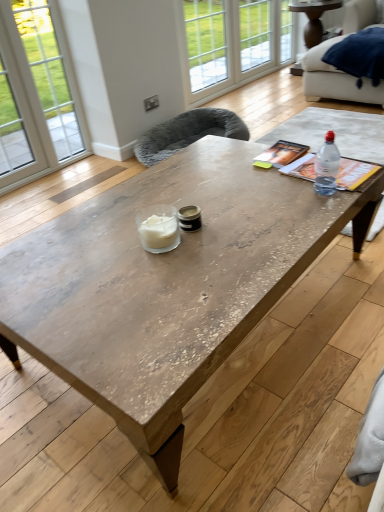
Question: Should I look upward or downward to see clear plastic bottle at upper right?

Choices:
 (A) up
 (B) down

Answer: (A)

Question: From a real-world perspective, is clear glass window at upper center, the 2th window from the left, located beneath wooden side table at upper right?

Choices:
 (A) no
 (B) yes

Answer: (A)

Question: Does clear glass window at upper center, the 2th window from the left, have a larger size compared to wooden side table at upper right?

Choices:
 (A) no
 (B) yes

Answer: (A)

Question: Is clear glass window at upper center, which ranks as the second window in right-to-left order, not inside wooden side table at upper right?

Choices:
 (A) yes
 (B) no

Answer: (A)

Question: Could you tell me if clear glass window at upper center, the 2th window from the left, is facing wooden side table at upper right?

Choices:
 (A) yes
 (B) no

Answer: (A)

Question: Considering the relative positions of clear glass window at upper center, which ranks as the second window in right-to-left order, and wooden side table at upper right in the image provided, is clear glass window at upper center, which ranks as the second window in right-to-left order, in front of wooden side table at upper right?

Choices:
 (A) no
 (B) yes

Answer: (A)

Question: Considering the relative sizes of clear glass window at upper center, the 2th window from the left, and wooden side table at upper right in the image provided, is clear glass window at upper center, the 2th window from the left, shorter than wooden side table at upper right?

Choices:
 (A) no
 (B) yes

Answer: (A)

Question: Is wooden side table at upper right surrounded by rustic wood coffee table at center?

Choices:
 (A) yes
 (B) no

Answer: (B)

Question: Is rustic wood coffee table at center facing towards wooden side table at upper right?

Choices:
 (A) yes
 (B) no

Answer: (B)

Question: From a real-world perspective, is rustic wood coffee table at center under wooden side table at upper right?

Choices:
 (A) no
 (B) yes

Answer: (B)

Question: Is rustic wood coffee table at center wider than wooden side table at upper right?

Choices:
 (A) yes
 (B) no

Answer: (A)

Question: Would you say rustic wood coffee table at center is outside wooden side table at upper right?

Choices:
 (A) no
 (B) yes

Answer: (B)

Question: Does rustic wood coffee table at center have a lesser width compared to wooden side table at upper right?

Choices:
 (A) no
 (B) yes

Answer: (A)

Question: Would you say rustic wood coffee table at center contains clear glass window at upper center, which appears as the first window when viewed from the right?

Choices:
 (A) yes
 (B) no

Answer: (B)